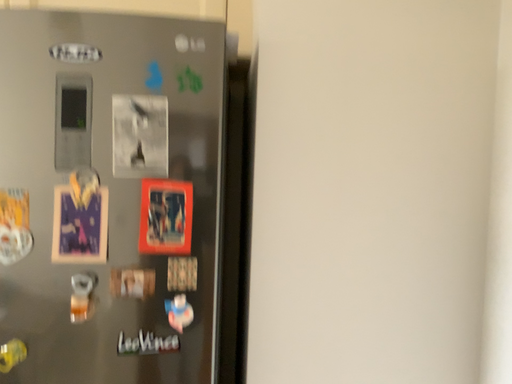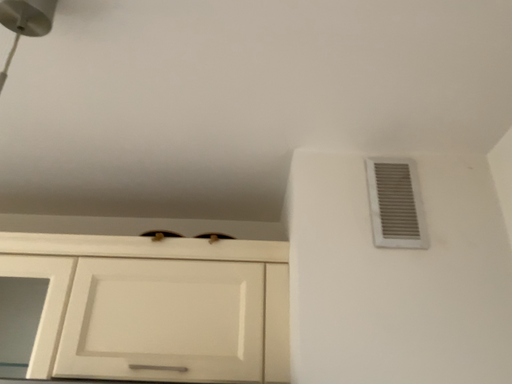
Question: Which way did the camera rotate in the video?

Choices:
 (A) rotated downward
 (B) rotated upward

Answer: (B)